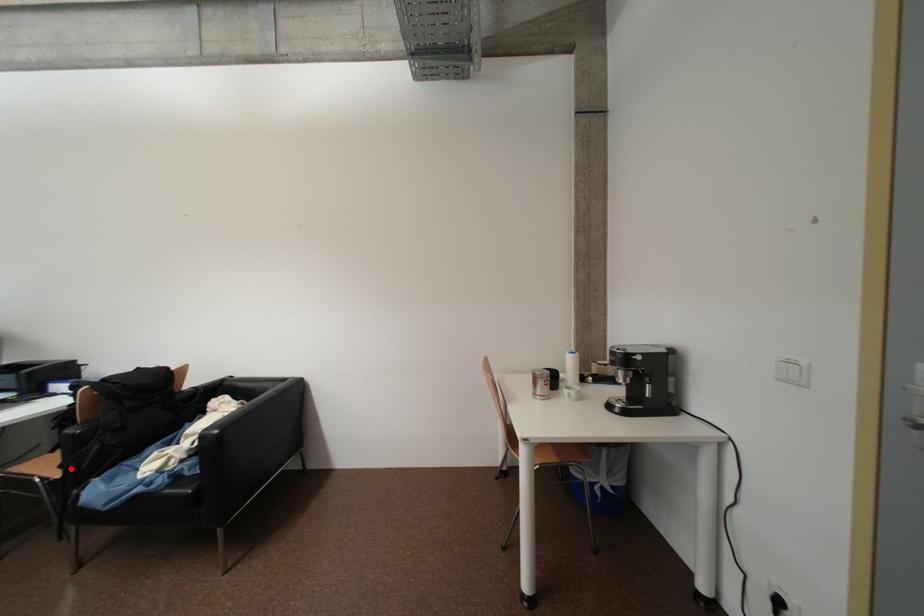
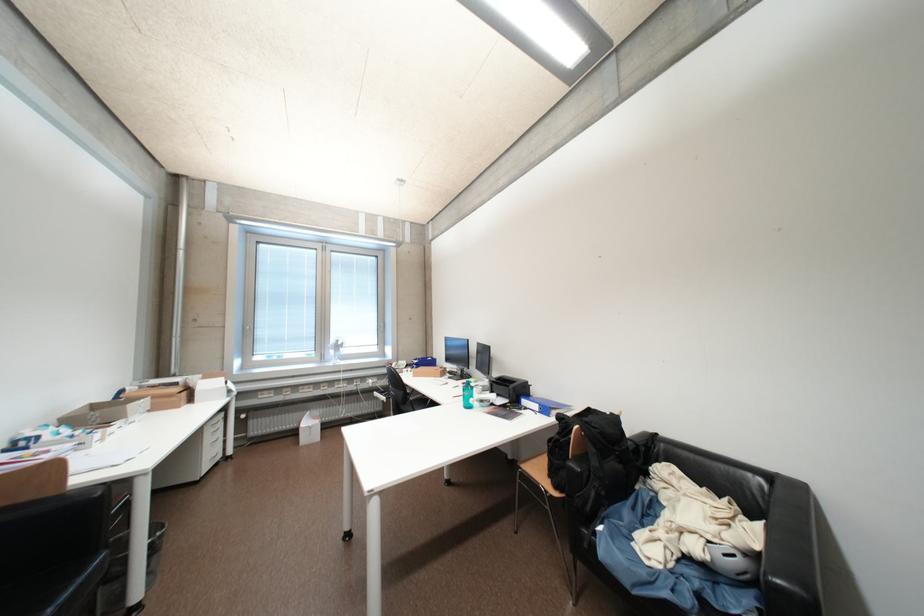
Question: A red point is marked in image1. In image2, is the corresponding 3D point closer to the camera or farther? Reply with the corresponding letter.

Choices:
 (A) The corresponding 3D point is closer.
 (B) The corresponding 3D point is farther.

Answer: (B)